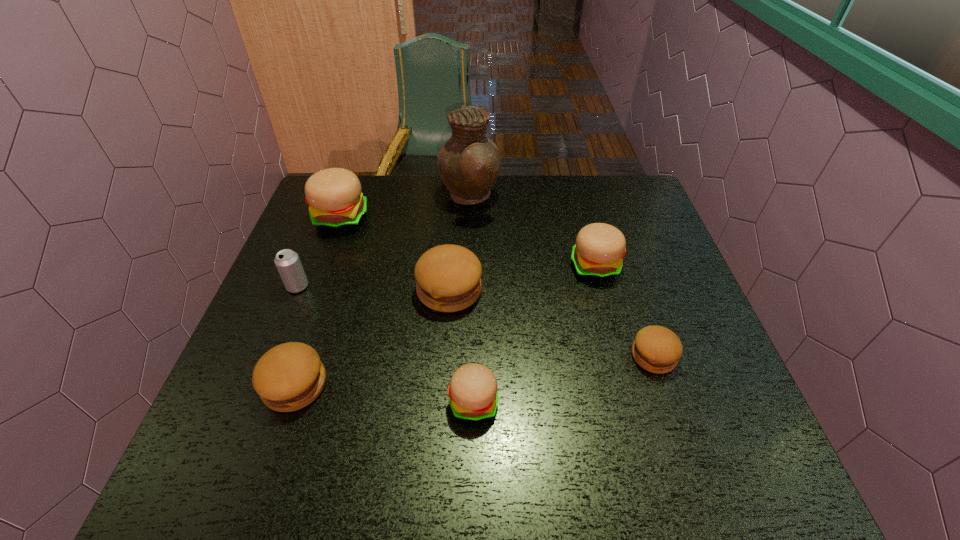
Where is `vacant region between the beer can and the seventh shortest object`? The height and width of the screenshot is (540, 960). vacant region between the beer can and the seventh shortest object is located at coordinates (319, 252).

Where is `free spot between the farthest beige hamburger and the shortest hamburger`? free spot between the farthest beige hamburger and the shortest hamburger is located at coordinates (497, 287).

Where is `blank region between the smallest beige hamburger and the leftmost brown hamburger`? The height and width of the screenshot is (540, 960). blank region between the smallest beige hamburger and the leftmost brown hamburger is located at coordinates (384, 394).

You are a GUI agent. You are given a task and a screenshot of the screen. Output one action in this format:
    pyautogui.click(x=<x>, y=<y>)
    Task: Click on the blank region between the shortest object and the second farthest beige hamburger
    The width and height of the screenshot is (960, 540).
    Given the screenshot: What is the action you would take?
    pyautogui.click(x=624, y=311)

I want to click on vacant space that's between the biggest brown hamburger and the smallest brown hamburger, so [x=551, y=323].

I want to click on vacant area that lies between the white beer can and the pitcher, so click(x=384, y=242).

Where is `free space that is in between the shortest object and the farthest brown hamburger`? This screenshot has height=540, width=960. free space that is in between the shortest object and the farthest brown hamburger is located at coordinates (551, 323).

The image size is (960, 540). Identify the location of free space between the farthest brown hamburger and the farthest hamburger. (395, 254).

Locate an element on the screen. object identified as the second closest to the second nearest beige hamburger is located at coordinates (469, 163).

At what (x,y) coordinates should I click in order to perform the action: click on object that is the closest to the brown pitcher. Please return your answer as a coordinate pair (x, y). This screenshot has height=540, width=960. Looking at the image, I should click on (448, 277).